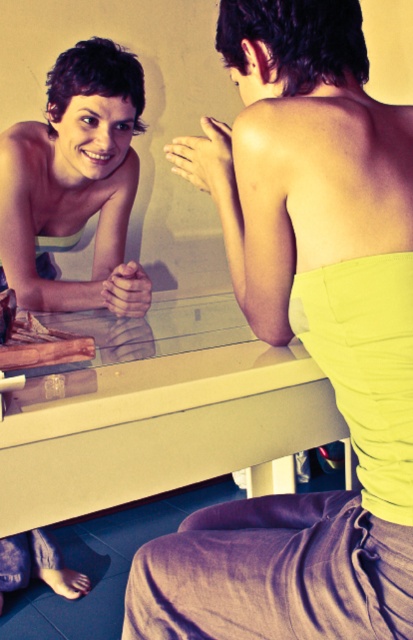
You are a fashion designer looking at the image of two tops. The matte yellow strapless top at upper right and the matte white tank top at upper left. Which top has a smaller size?

The matte yellow strapless top at upper right has a smaller size compared to the matte white tank top at upper left.

You are arranging a small potted plant on the matte glass table at center and the matte white tank top at upper left. Which surface can you place the plant on without it being obstructed by the other object?

The matte glass table at center is positioned on the right side of the matte white tank top at upper left, so placing the plant on the matte glass table at center would avoid obstruction from the matte white tank top at upper left.

You have a 12 inch ruler. You want to measure the distance between the matte glass table at center and the matte white tank top at upper left. Will your ruler be long enough to measure the distance?

The distance between the matte glass table at center and the matte white tank top at upper left is 12.55 inches. Since the ruler is only 12 inches long, it is not long enough to fully measure the distance between them.